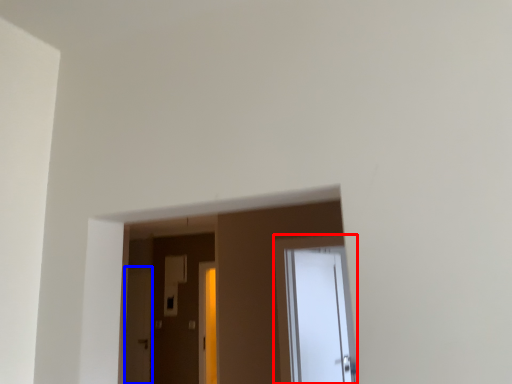
Question: Among these objects, which one is farthest to the camera, door (highlighted by a red box) or screen door (highlighted by a blue box)?

Choices:
 (A) door
 (B) screen door

Answer: (B)